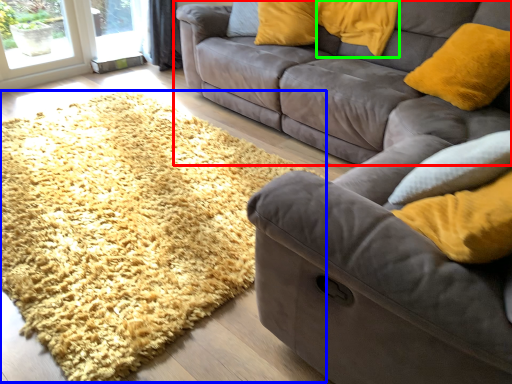
Question: Based on their relative distances, which object is nearer to studio couch (highlighted by a red box)? Choose from mat (highlighted by a blue box) and pillow (highlighted by a green box).

Choices:
 (A) mat
 (B) pillow

Answer: (B)